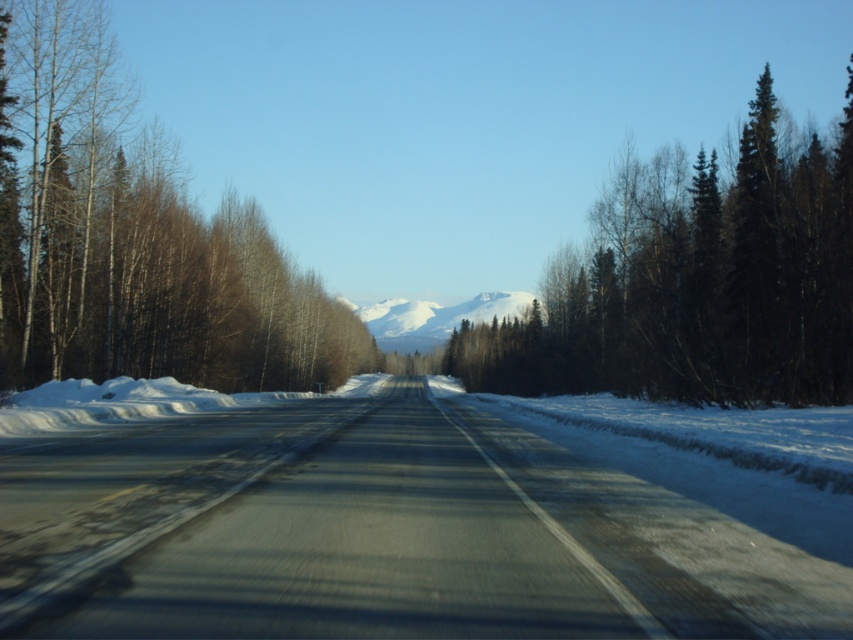
Based on the photo, which of these two, smooth asphalt road at center or snowy white mountain at center, stands shorter?

Standing shorter between the two is smooth asphalt road at center.

Does smooth asphalt road at center have a smaller size compared to snowy white mountain at center?

Indeed, smooth asphalt road at center has a smaller size compared to snowy white mountain at center.

Is point (332, 417) in front of point (387, 317)?

Yes, point (332, 417) is closer to viewer.

Locate an element on the screen. smooth asphalt road at center is located at coordinates (379, 534).

How much distance is there between smooth asphalt road at center and dark green textured evergreen tree at right?

38.16 meters

Is smooth asphalt road at center closer to camera compared to dark green textured evergreen tree at right?

That is True.

Locate an element on the screen. Image resolution: width=853 pixels, height=640 pixels. smooth asphalt road at center is located at coordinates (379, 534).

This screenshot has height=640, width=853. What are the coordinates of `smooth asphalt road at center` in the screenshot? It's located at (379, 534).

From the picture: Is brown bark trees at left wider than snowy white mountain at center?

In fact, brown bark trees at left might be narrower than snowy white mountain at center.

Is brown bark trees at left to the left of snowy white mountain at center from the viewer's perspective?

Correct, you'll find brown bark trees at left to the left of snowy white mountain at center.

Which is behind, point (107, 49) or point (408, 332)?

Positioned behind is point (408, 332).

The width and height of the screenshot is (853, 640). I want to click on brown bark trees at left, so click(138, 246).